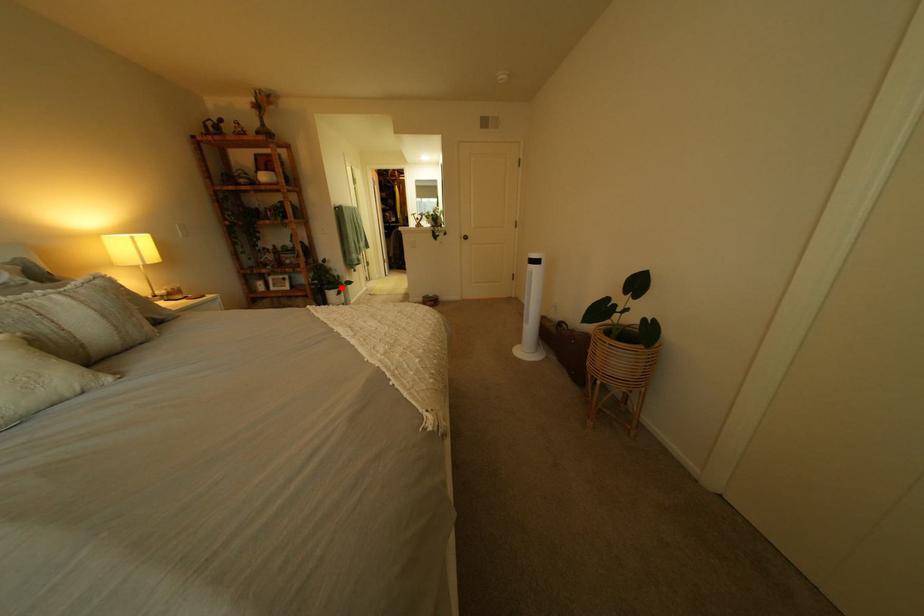
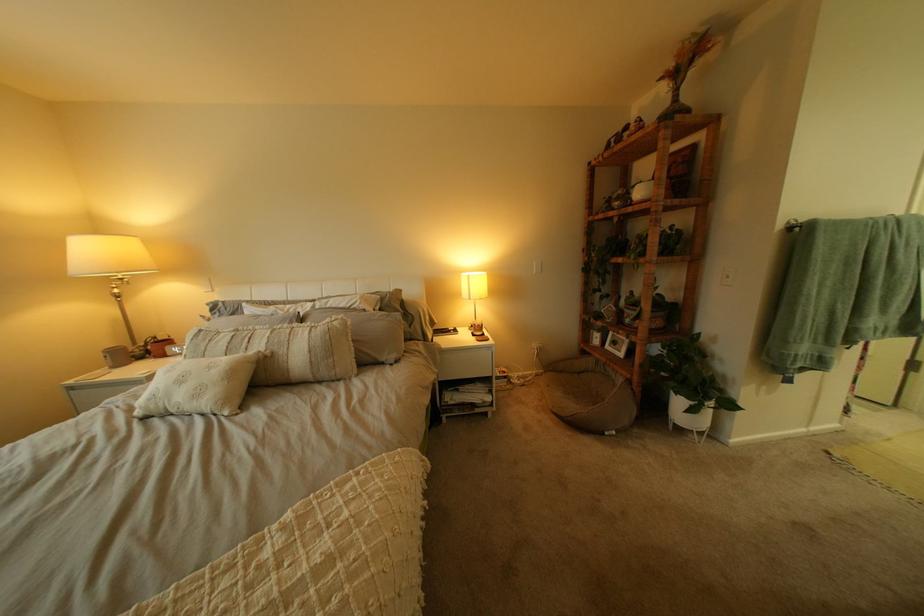
Question: I am providing you with two images of the same scene from different viewpoints. Image1 has a red point marked. In image2, the corresponding 3D location appears at what relative position? Reply with the corresponding letter.

Choices:
 (A) Closer
 (B) Farther

Answer: (B)